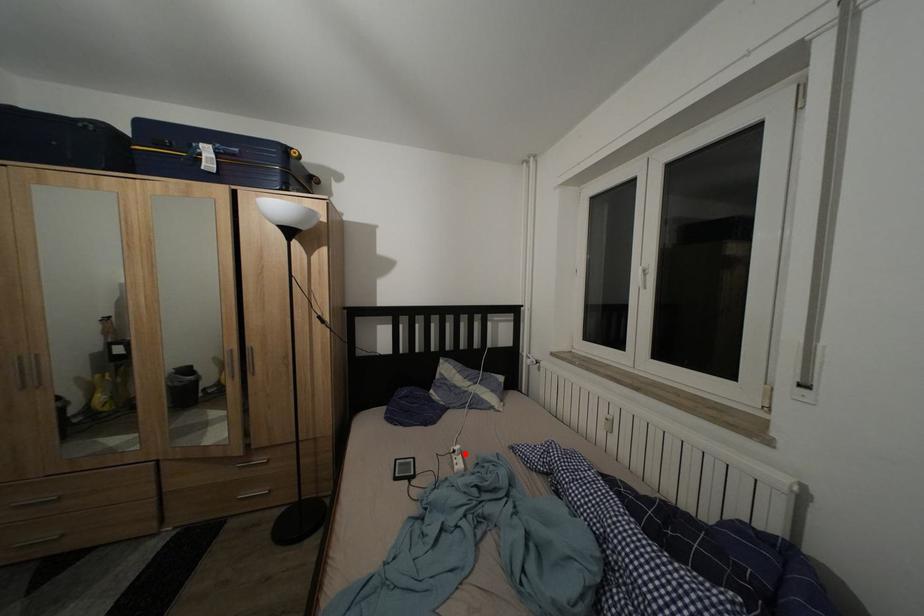
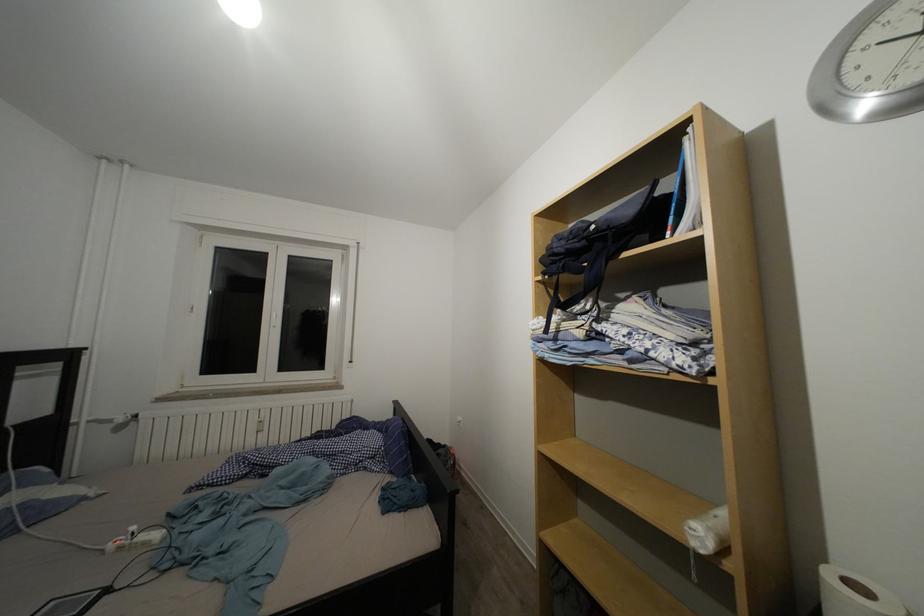
Where in the second image is the point corresponding to the highlighted location from the first image?

(140, 533)